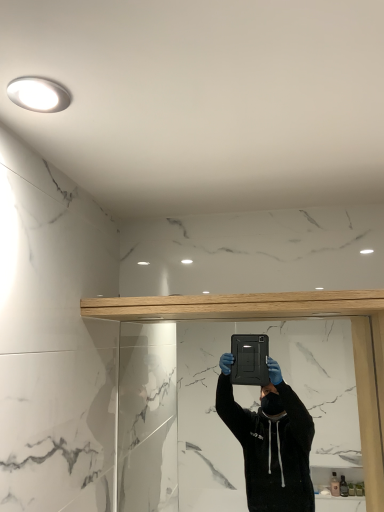
Question: From a real-world perspective, is white glossy light fixture at upper left positioned above or below black matte mirror at center?

Choices:
 (A) above
 (B) below

Answer: (A)

Question: Would you say white glossy light fixture at upper left is inside or outside black matte mirror at center?

Choices:
 (A) outside
 (B) inside

Answer: (A)

Question: Estimate the real-world distances between objects in this image. Which object is closer to the light oak wood beam at upper center?

Choices:
 (A) white glossy light fixture at upper left
 (B) black matte mirror at center

Answer: (B)

Question: Based on their relative distances, which object is nearer to the light oak wood beam at upper center?

Choices:
 (A) white glossy light fixture at upper left
 (B) black matte mirror at center

Answer: (B)